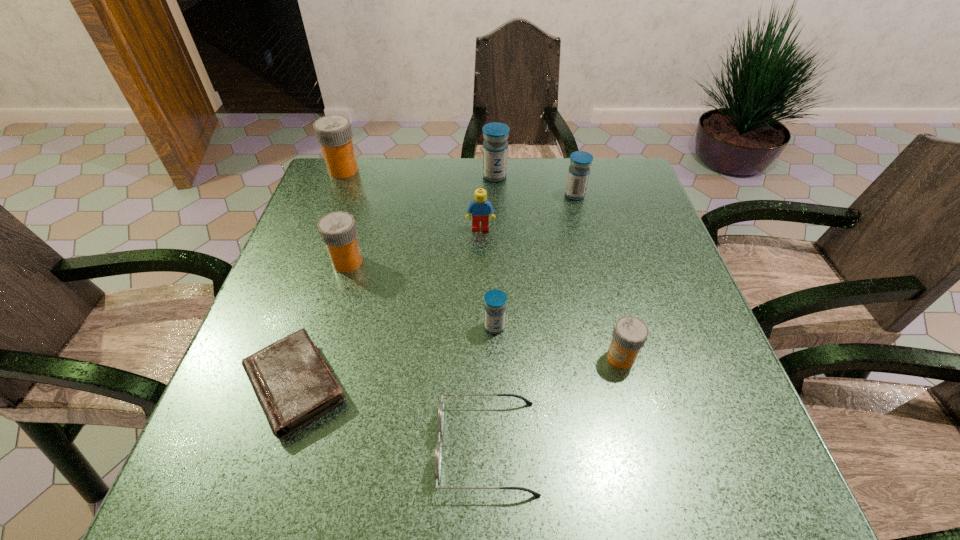
You are a GUI agent. You are given a task and a screenshot of the screen. Output one action in this format:
    pyautogui.click(x=<x>, y=<y>)
    Task: Click on the object at the right edge
    The height and width of the screenshot is (540, 960).
    Given the screenshot: What is the action you would take?
    pyautogui.click(x=630, y=333)

At what (x,y) coordinates should I click in order to perform the action: click on object that is at the far left corner. Please return your answer as a coordinate pair (x, y). The height and width of the screenshot is (540, 960). Looking at the image, I should click on (334, 133).

Identify the location of vacant space at the far edge of the desktop. This screenshot has width=960, height=540. (556, 197).

The width and height of the screenshot is (960, 540). I want to click on vacant space at the near edge, so click(x=576, y=497).

Locate an element on the screen. This screenshot has height=540, width=960. vacant region at the left edge of the desktop is located at coordinates (238, 390).

The image size is (960, 540). Identify the location of free space at the right edge of the desktop. (652, 306).

You are a GUI agent. You are given a task and a screenshot of the screen. Output one action in this format:
    pyautogui.click(x=<x>, y=<y>)
    Task: Click on the vacant space at the far left corner
    This screenshot has width=960, height=540.
    Given the screenshot: What is the action you would take?
    pyautogui.click(x=364, y=158)

The height and width of the screenshot is (540, 960). Identify the location of vacant region at the near left corner. (217, 486).

In the image, there is a desktop. At what (x,y) coordinates should I click in order to perform the action: click on free space at the near right corner. Please return your answer as a coordinate pair (x, y). This screenshot has height=540, width=960. Looking at the image, I should click on point(748,472).

Identify the location of vacant region between the sunglasses and the diary. (392, 416).